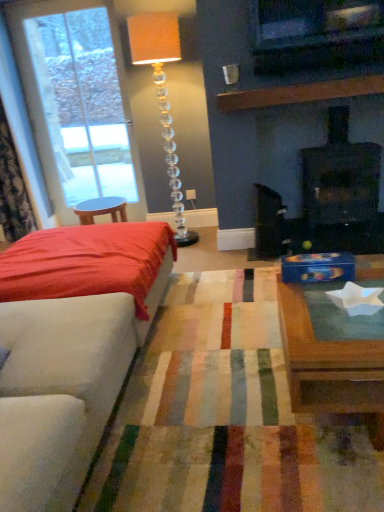
Question: Is translucent crystal floor lamp at center aimed at satin red bed at left?

Choices:
 (A) no
 (B) yes

Answer: (A)

Question: From the image's perspective, is translucent crystal floor lamp at center below satin red bed at left?

Choices:
 (A) no
 (B) yes

Answer: (A)

Question: Is the surface of translucent crystal floor lamp at center in direct contact with satin red bed at left?

Choices:
 (A) yes
 (B) no

Answer: (B)

Question: Is satin red bed at left completely or partially inside translucent crystal floor lamp at center?

Choices:
 (A) yes
 (B) no

Answer: (B)

Question: Is translucent crystal floor lamp at center to the right of satin red bed at left from the viewer's perspective?

Choices:
 (A) yes
 (B) no

Answer: (A)

Question: Considering the positions of point (49, 219) and point (69, 54), is point (49, 219) closer or farther from the camera than point (69, 54)?

Choices:
 (A) closer
 (B) farther

Answer: (B)

Question: Considering the positions of velvet floral curtain at left and clear glass door at left in the image, is velvet floral curtain at left wider or thinner than clear glass door at left?

Choices:
 (A) wide
 (B) thin

Answer: (A)

Question: In terms of size, does velvet floral curtain at left appear bigger or smaller than clear glass door at left?

Choices:
 (A) big
 (B) small

Answer: (A)

Question: Is velvet floral curtain at left taller or shorter than clear glass door at left?

Choices:
 (A) tall
 (B) short

Answer: (B)

Question: Is point (177, 58) closer or farther from the camera than point (16, 147)?

Choices:
 (A) farther
 (B) closer

Answer: (B)

Question: From the image's perspective, is translucent crystal floor lamp at center located above or below velvet floral curtain at left?

Choices:
 (A) above
 (B) below

Answer: (B)

Question: Based on their sizes in the image, would you say translucent crystal floor lamp at center is bigger or smaller than velvet floral curtain at left?

Choices:
 (A) big
 (B) small

Answer: (B)

Question: From a real-world perspective, is translucent crystal floor lamp at center above or below velvet floral curtain at left?

Choices:
 (A) above
 (B) below

Answer: (B)

Question: From the image's perspective, is translucent crystal floor lamp at center located above or below black matte fireplace at upper right?

Choices:
 (A) above
 (B) below

Answer: (A)

Question: Which is correct: translucent crystal floor lamp at center is inside black matte fireplace at upper right, or outside of it?

Choices:
 (A) outside
 (B) inside

Answer: (A)